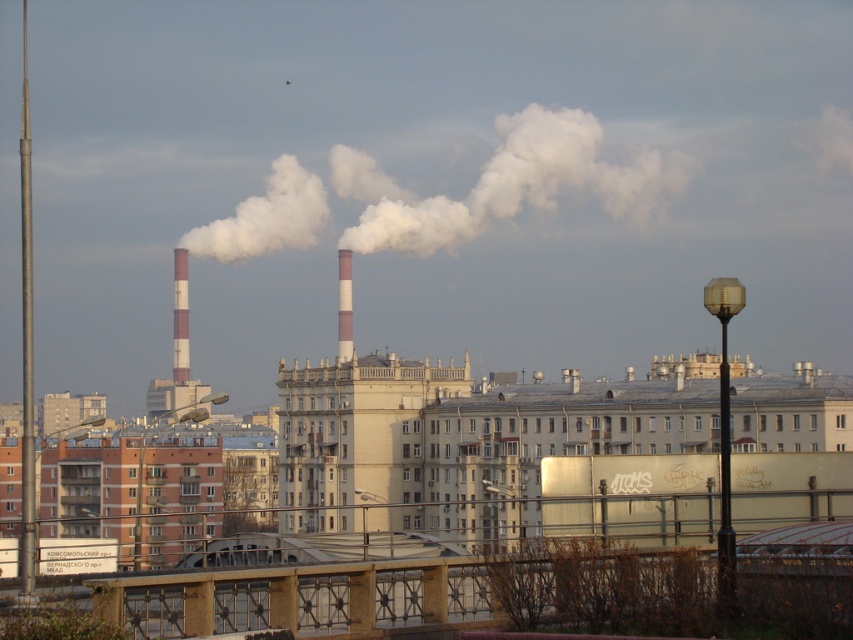
Which is more to the right, white smoke at center or white striped chimney at center?

white smoke at center

Between point (672, 168) and point (344, 284), which one is positioned in front?

Positioned in front is point (344, 284).

Locate an element on the screen. The height and width of the screenshot is (640, 853). white smoke at center is located at coordinates (503, 182).

Is red brick chimney at center wider than white striped chimney at center?

Yes.

Between red brick chimney at center and white striped chimney at center, which one appears on the left side from the viewer's perspective?

red brick chimney at center is more to the left.

What do you see at coordinates (180, 317) in the screenshot? The width and height of the screenshot is (853, 640). I see `red brick chimney at center` at bounding box center [180, 317].

You are a GUI agent. You are given a task and a screenshot of the screen. Output one action in this format:
    pyautogui.click(x=<x>, y=<y>)
    Task: Click on the red brick chimney at center
    Image resolution: width=853 pixels, height=640 pixels.
    Given the screenshot: What is the action you would take?
    pyautogui.click(x=180, y=317)

Between point (341, 248) and point (180, 252), which one is positioned in front?

Positioned in front is point (180, 252).

Is white smoke at center to the left of red brick chimney at center from the viewer's perspective?

In fact, white smoke at center is to the right of red brick chimney at center.

Does point (258, 244) come closer to viewer compared to point (173, 280)?

Yes, point (258, 244) is in front of point (173, 280).

Locate an element on the screen. Image resolution: width=853 pixels, height=640 pixels. white smoke at center is located at coordinates (503, 182).